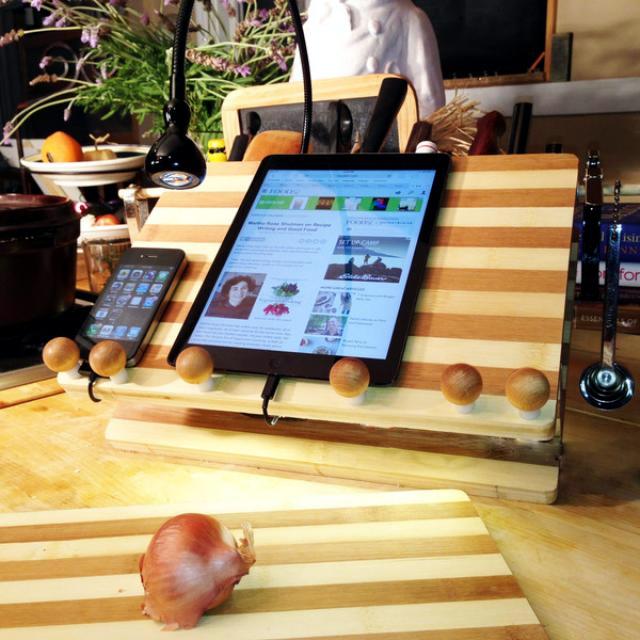
Where is `knobs`? The image size is (640, 640). knobs is located at coordinates (479, 372).